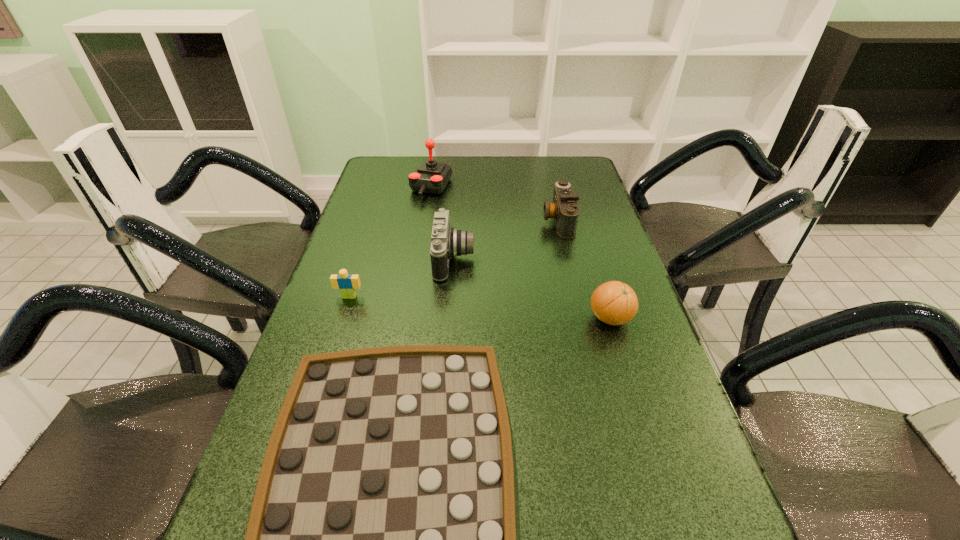
The height and width of the screenshot is (540, 960). I want to click on joystick, so click(431, 177).

The height and width of the screenshot is (540, 960). Identify the location of the tallest object. (431, 177).

Where is `the left camera`? This screenshot has height=540, width=960. the left camera is located at coordinates (446, 242).

Identify the location of the second tallest object. (x=446, y=242).

The width and height of the screenshot is (960, 540). I want to click on the second nearest object, so click(x=614, y=303).

This screenshot has width=960, height=540. I want to click on the shorter camera, so click(x=564, y=209).

Where is `Lego`? Lego is located at coordinates [347, 284].

Locate an element on the screen. Image resolution: width=960 pixels, height=540 pixels. the third nearest object is located at coordinates (347, 284).

Find the location of a particular element. This screenshot has height=540, width=960. vacant region located 0.150m on the left of the joystick is located at coordinates (367, 187).

Find the location of a particular element. The height and width of the screenshot is (540, 960). free space located on the front-facing side of the second tallest object is located at coordinates (499, 259).